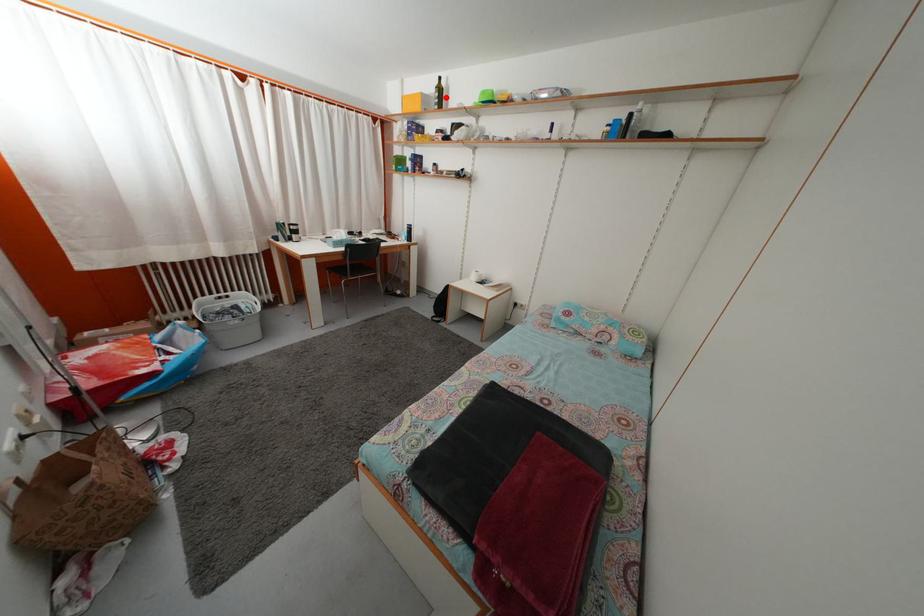
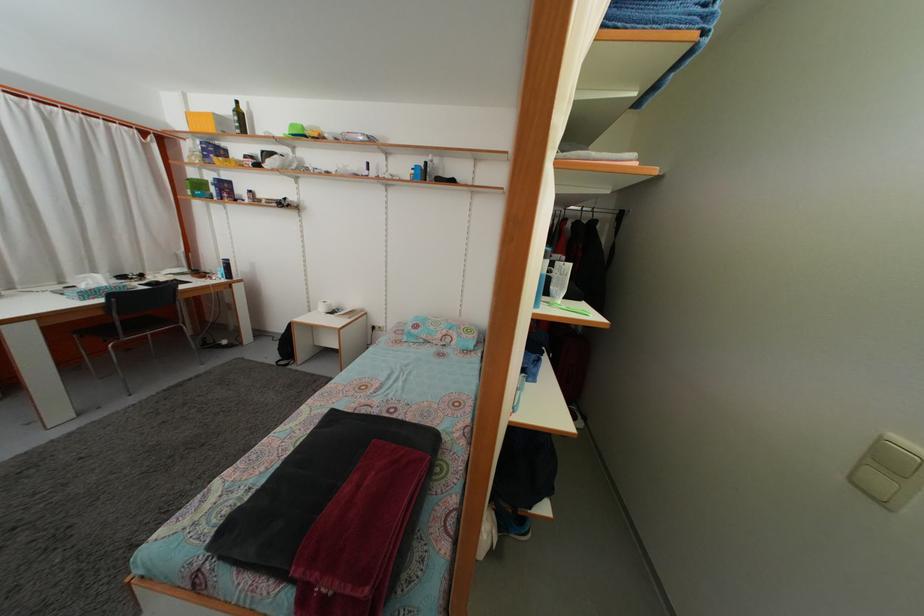
In the second image, find the point that corresponds to the highlighted location in the first image.

(246, 122)